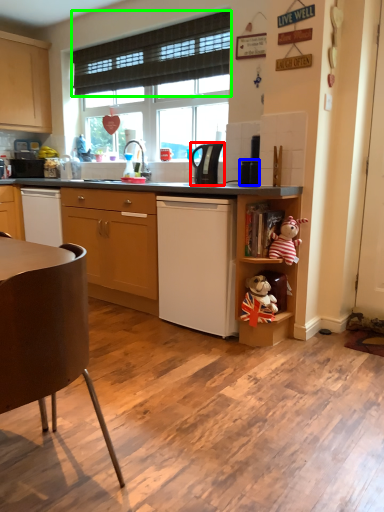
Question: Which object is the farthest from kitchen appliance (highlighted by a red box)? Choose among these: appliance (highlighted by a blue box) or curtain (highlighted by a green box).

Choices:
 (A) appliance
 (B) curtain

Answer: (B)